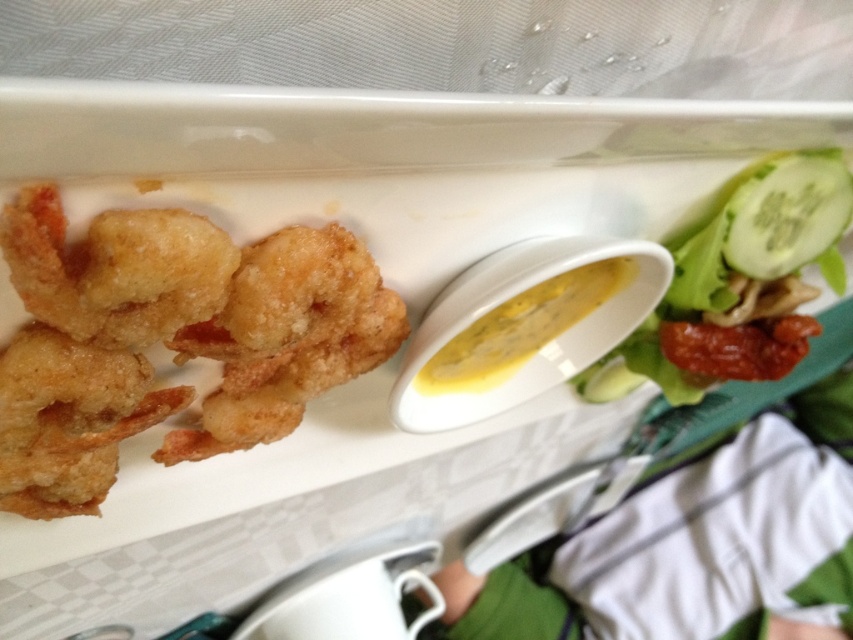
Consider the image. You are a food critic evaluating this meal. You need to describe the spatial arrangement of the golden crispy shrimp at upper left and the green leafy salad at upper right. Which one takes up more horizontal space on the plate?

The green leafy salad at upper right takes up more horizontal space than the golden crispy shrimp at upper left because its width is greater.